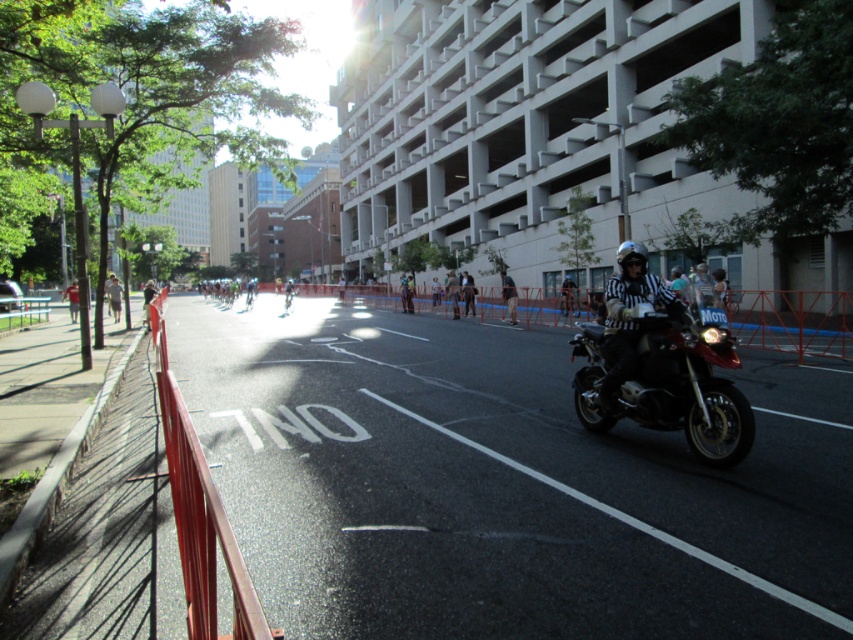
Question: Where is black leather helmet at center located in relation to black leather jacket at center in the image?

Choices:
 (A) left
 (B) right

Answer: (B)

Question: Is shiny black motorcycle at right below red shirt at center?

Choices:
 (A) yes
 (B) no

Answer: (A)

Question: Is white striped shirt at right thinner than striped referee shirt at center?

Choices:
 (A) no
 (B) yes

Answer: (A)

Question: Which point is farther from the camera taking this photo?

Choices:
 (A) (613, 275)
 (B) (68, 292)
 (C) (567, 284)

Answer: (A)

Question: Which point appears closest to the camera in this image?

Choices:
 (A) (450, 280)
 (B) (608, 408)

Answer: (B)

Question: Which point is closer to the camera taking this photo?

Choices:
 (A) (67, 288)
 (B) (432, 284)

Answer: (A)